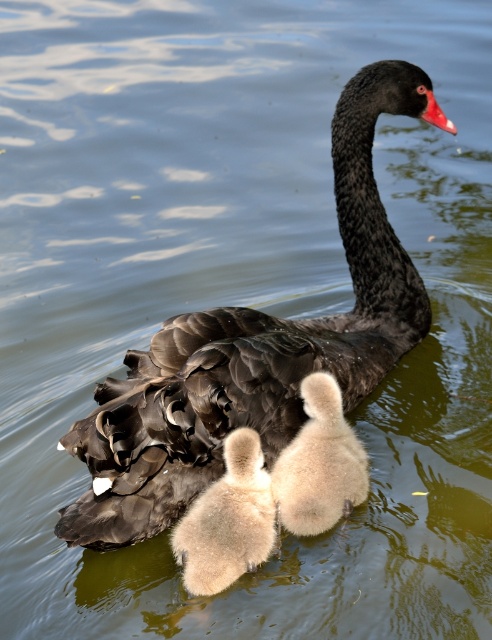
Is soft beige duckling at center to the left of fluffy white duckling at center from the viewer's perspective?

Indeed, soft beige duckling at center is positioned on the left side of fluffy white duckling at center.

Is soft beige duckling at center positioned behind fluffy white duckling at center?

That is False.

This screenshot has height=640, width=492. I want to click on soft beige duckling at center, so (x=227, y=520).

At what (x,y) coordinates should I click in order to perform the action: click on soft beige duckling at center. Please return your answer as a coordinate pair (x, y). Looking at the image, I should click on (227, 520).

Does black glossy swan at center have a lesser height compared to soft beige duckling at center?

No.

Measure the distance from black glossy swan at center to soft beige duckling at center.

They are 17.00 inches apart.

Is point (369, 268) behind point (247, 452)?

Yes, it is behind point (247, 452).

Identify the location of black glossy swan at center. This screenshot has height=640, width=492. coord(253,349).

Is black glossy swan at center above fluffy white duckling at center?

Correct, black glossy swan at center is located above fluffy white duckling at center.

Between black glossy swan at center and fluffy white duckling at center, which one is positioned lower?

fluffy white duckling at center is lower down.

Image resolution: width=492 pixels, height=640 pixels. What do you see at coordinates (253, 349) in the screenshot?
I see `black glossy swan at center` at bounding box center [253, 349].

At what (x,y) coordinates should I click in order to perform the action: click on black glossy swan at center. Please return your answer as a coordinate pair (x, y). Looking at the image, I should click on (253, 349).